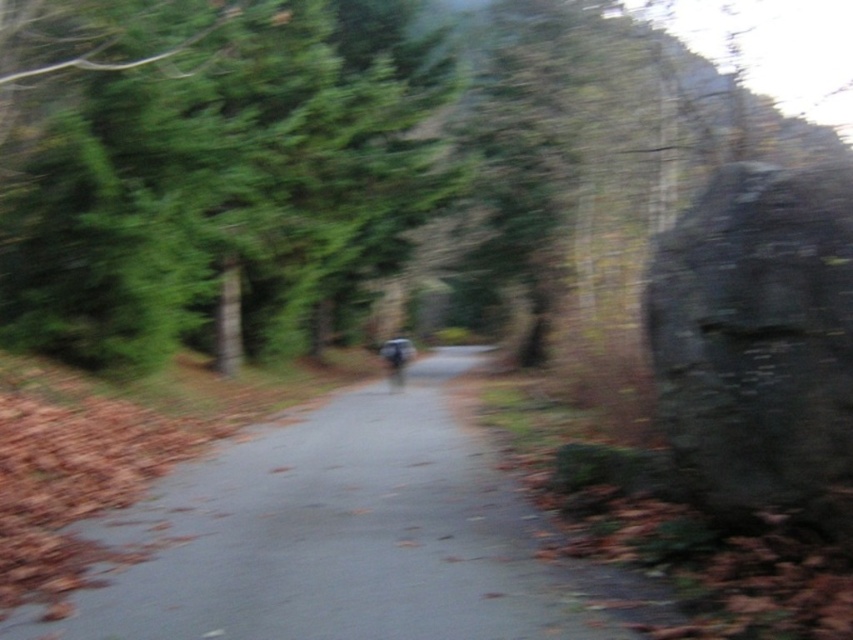
Question: Considering the relative positions of green leafy tree at upper left and metallic silver motorcycle at center in the image provided, where is green leafy tree at upper left located with respect to metallic silver motorcycle at center?

Choices:
 (A) right
 (B) left

Answer: (B)

Question: Is dark gray stone boulder at right above metallic silver motorcycle at center?

Choices:
 (A) yes
 (B) no

Answer: (A)

Question: Is the position of dark gray stone boulder at right less distant than that of metallic silver motorcycle at center?

Choices:
 (A) yes
 (B) no

Answer: (A)

Question: Among these points, which one is nearest to the camera?

Choices:
 (A) (416, 468)
 (B) (13, 230)

Answer: (A)

Question: Among these objects, which one is nearest to the camera?

Choices:
 (A) green leafy tree at upper left
 (B) dark gray stone boulder at right
 (C) smooth asphalt trail at center

Answer: (C)

Question: Which point is closer to the camera?

Choices:
 (A) smooth asphalt trail at center
 (B) dark gray stone boulder at right
 (C) green leafy tree at upper left

Answer: (A)